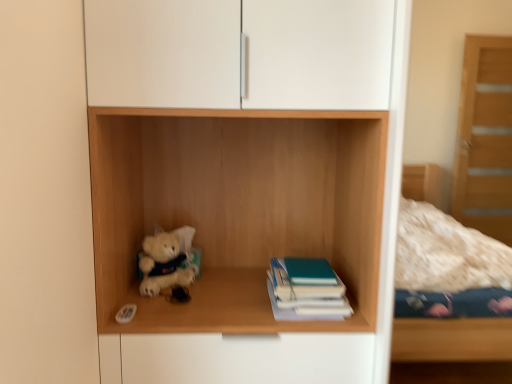
What do you see at coordinates (300, 108) in the screenshot?
I see `wooden shelf at center` at bounding box center [300, 108].

Locate an element on the screen. The height and width of the screenshot is (384, 512). teal matte book at center is located at coordinates (308, 289).

From a real-world perspective, is fluffy white teddy bear at lower left positioned above or below wooden shelf at center?

fluffy white teddy bear at lower left is below wooden shelf at center.

From the image's perspective, which object appears higher, fluffy white teddy bear at lower left or wooden shelf at center?

wooden shelf at center.

Who is smaller, fluffy white teddy bear at lower left or wooden shelf at center?

Smaller between the two is fluffy white teddy bear at lower left.

Considering the points (165, 276) and (116, 100), which point is in front, point (165, 276) or point (116, 100)?

The point (116, 100) is closer to the camera.

Are teal matte book at center and wooden shelf at center making contact?

No, teal matte book at center is not touching wooden shelf at center.

From a real-world perspective, who is located higher, teal matte book at center or wooden shelf at center?

wooden shelf at center.

How many degrees apart are the facing directions of teal matte book at center and wooden shelf at center?

They differ by 1.81 degrees in their facing directions.

Does teal matte book at center have a greater width compared to wooden shelf at center?

No.

Is fluffy white teddy bear at lower left far from teal matte book at center?

No, fluffy white teddy bear at lower left is not far from teal matte book at center.

This screenshot has height=384, width=512. I want to click on teddy bear above the teal matte book at center (from the image's perspective), so click(163, 264).

Does point (155, 288) appear closer or farther from the camera than point (343, 304)?

Clearly, point (155, 288) is more distant from the camera than point (343, 304).

From the image's perspective, would you say fluffy white teddy bear at lower left is positioned over teal matte book at center?

Yes, from the image's perspective, fluffy white teddy bear at lower left is on top of teal matte book at center.

From a real-world perspective, does wooden shelf at center stand above teal matte book at center?

Yes.

From the image's perspective, is wooden shelf at center on teal matte book at center?

Yes, from the image's perspective, wooden shelf at center is above teal matte book at center.

Could you tell me if wooden shelf at center is turned towards teal matte book at center?

Yes.

Is the position of teal matte book at center more distant than that of fluffy white teddy bear at lower left?

No, teal matte book at center is closer to the viewer.

Is teal matte book at center positioned with its back to fluffy white teddy bear at lower left?

No, teal matte book at center is not facing the opposite direction of fluffy white teddy bear at lower left.

From the image's perspective, would you say teal matte book at center is shown under fluffy white teddy bear at lower left?

Yes, from the image's perspective, teal matte book at center is below fluffy white teddy bear at lower left.

Do you think teal matte book at center is within fluffy white teddy bear at lower left, or outside of it?

teal matte book at center exists outside the volume of fluffy white teddy bear at lower left.

From a real-world perspective, is wooden shelf at center positioned over fluffy white teddy bear at lower left based on gravity?

Yes, from a real-world perspective, wooden shelf at center is on top of fluffy white teddy bear at lower left.

Which of these two, wooden shelf at center or fluffy white teddy bear at lower left, stands shorter?

fluffy white teddy bear at lower left.

Does point (387, 213) come farther from viewer compared to point (152, 266)?

No, (387, 213) is closer to viewer.

Image resolution: width=512 pixels, height=384 pixels. I want to click on teddy bear below the wooden shelf at center (from a real-world perspective), so click(163, 264).

In order to click on book that is below the wooden shelf at center (from the image's perspective) in this screenshot , I will do `click(308, 289)`.

From the image, which object appears to be nearer to teal matte book at center, wooden shelf at center or fluffy white teddy bear at lower left?

wooden shelf at center is positioned closer to the anchor teal matte book at center.

Estimate the real-world distances between objects in this image. Which object is further from wooden shelf at center, fluffy white teddy bear at lower left or teal matte book at center?

Among the two, fluffy white teddy bear at lower left is located further to wooden shelf at center.

Considering their positions, is fluffy white teddy bear at lower left positioned further to teal matte book at center than wooden shelf at center?

fluffy white teddy bear at lower left is positioned further to the anchor teal matte book at center.

Estimate the real-world distances between objects in this image. Which object is closer to wooden shelf at center, teal matte book at center or fluffy white teddy bear at lower left?

teal matte book at center is positioned closer to the anchor wooden shelf at center.

Estimate the real-world distances between objects in this image. Which object is closer to fluffy white teddy bear at lower left, wooden shelf at center or teal matte book at center?

teal matte book at center lies closer to fluffy white teddy bear at lower left than the other object.

Estimate the real-world distances between objects in this image. Which object is closer to fluffy white teddy bear at lower left, teal matte book at center or wooden shelf at center?

Among the two, teal matte book at center is located nearer to fluffy white teddy bear at lower left.

This screenshot has height=384, width=512. I want to click on cupboard between fluffy white teddy bear at lower left and teal matte book at center, so click(300, 108).